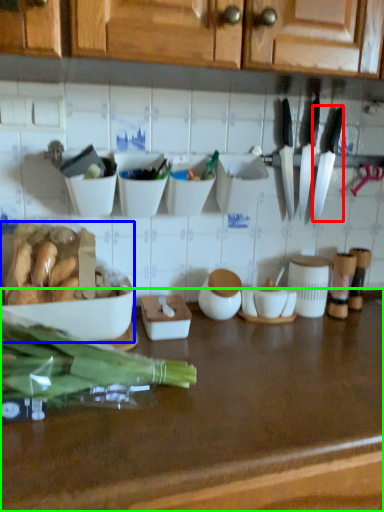
Question: Which object is positioned closest to kitchen knife (highlighted by a red box)? Select from tableware (highlighted by a blue box) and countertop (highlighted by a green box).

Choices:
 (A) tableware
 (B) countertop

Answer: (B)